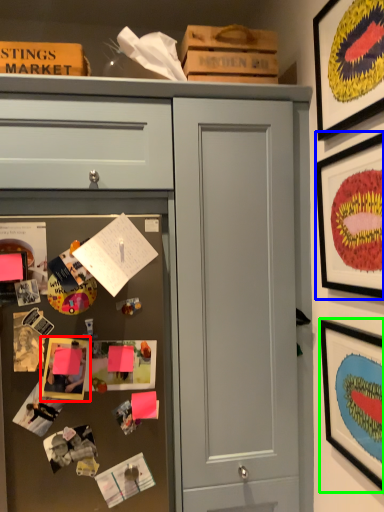
Question: Which object is the farthest from picture frame (highlighted by a red box)? Choose among these: picture frame (highlighted by a blue box) or picture frame (highlighted by a green box).

Choices:
 (A) picture frame
 (B) picture frame

Answer: (A)